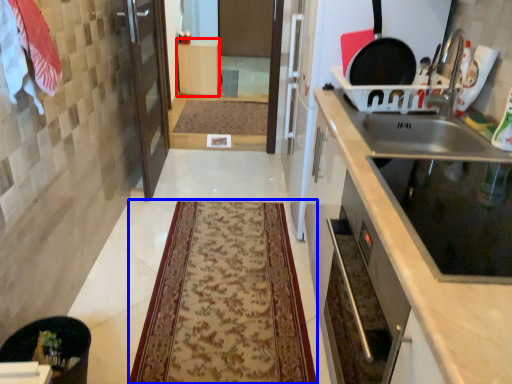
Question: Which point is further to the camera, cabinetry (highlighted by a red box) or mat (highlighted by a blue box)?

Choices:
 (A) cabinetry
 (B) mat

Answer: (A)